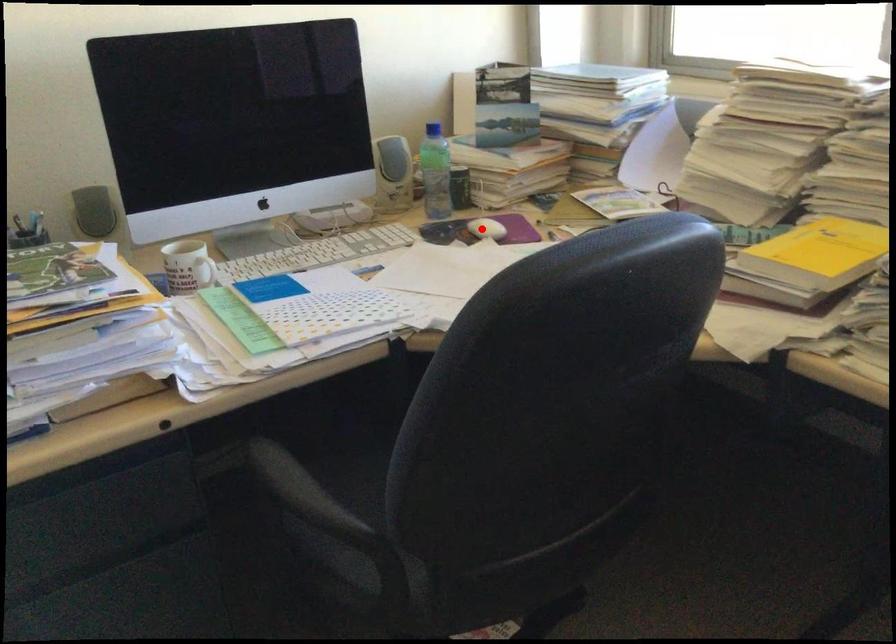
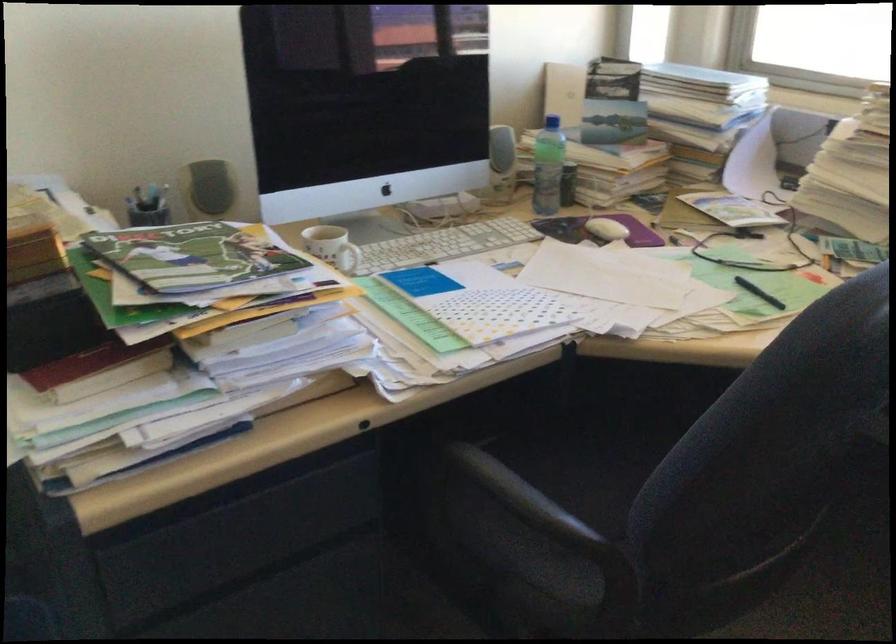
In the second image, find the point that corresponds to the highlighted location in the first image.

(606, 229)